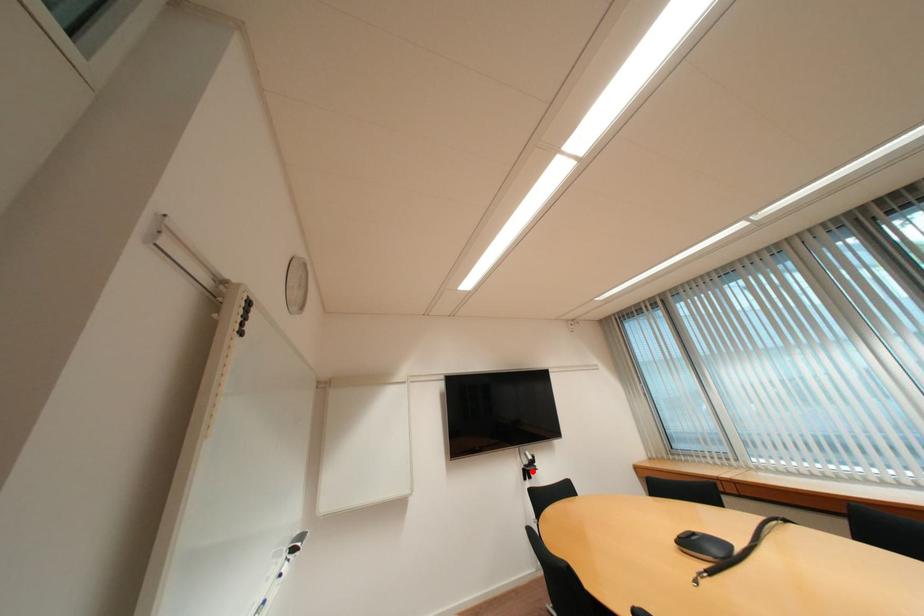
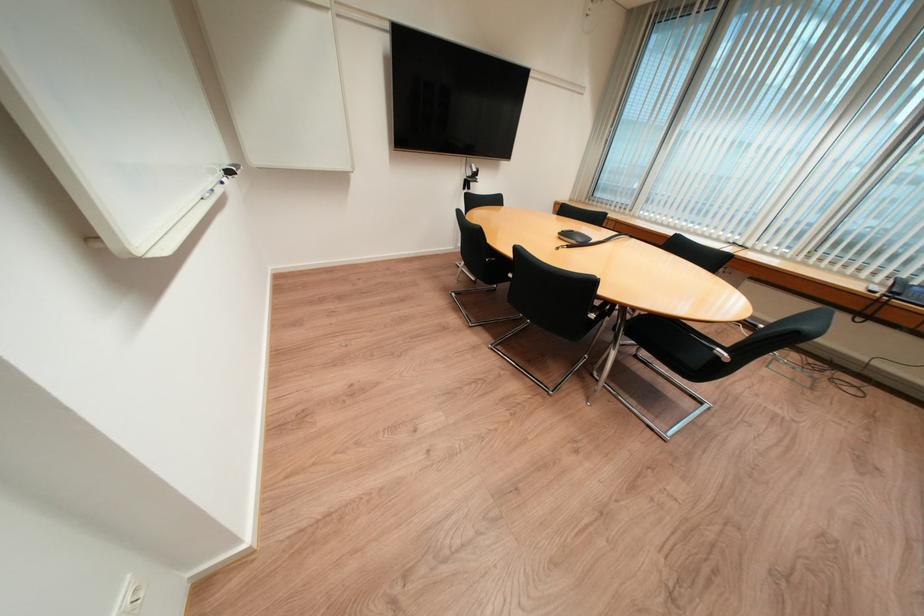
Question: I am providing you with two images of the same scene from different viewpoints. In image1, a red point is highlighted. Considering the same 3D point in image2, which of the following is correct?

Choices:
 (A) It is closer
 (B) It is farther

Answer: (A)